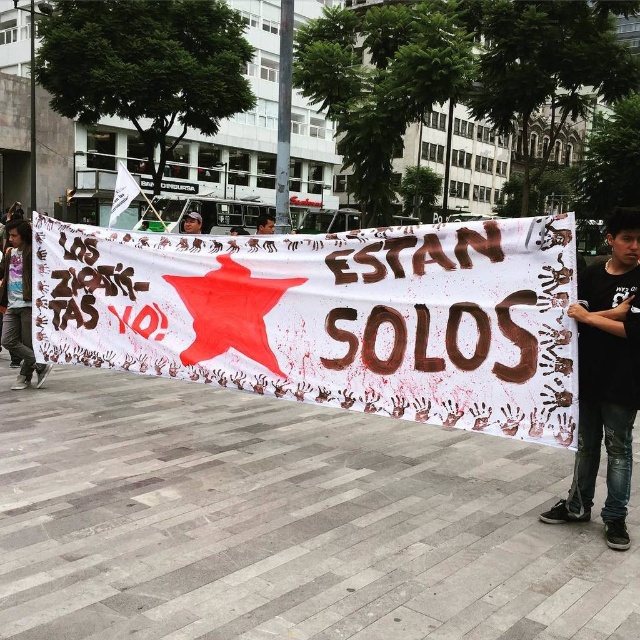
Question: Can you confirm if white paper banner at center is smaller than dark hair at center?

Choices:
 (A) yes
 (B) no

Answer: (A)

Question: Which of the following is the farthest from the observer?

Choices:
 (A) vivid purple t-shirt at left
 (B) black cotton shirt at lower right
 (C) dark hair at center
 (D) white paper banner at center

Answer: (C)

Question: Does white paper banner at center appear over black cotton shirt at lower right?

Choices:
 (A) yes
 (B) no

Answer: (A)

Question: Which point is farther from the camera taking this photo?

Choices:
 (A) coord(131,177)
 (B) coord(266,225)
 (C) coord(22,317)
 (D) coord(476,308)

Answer: (A)

Question: Which object appears farthest from the camera in this image?

Choices:
 (A) dark hair at center
 (B) white paper flag at upper left

Answer: (A)

Question: Is vivid purple t-shirt at left below white paper flag at upper left?

Choices:
 (A) yes
 (B) no

Answer: (A)